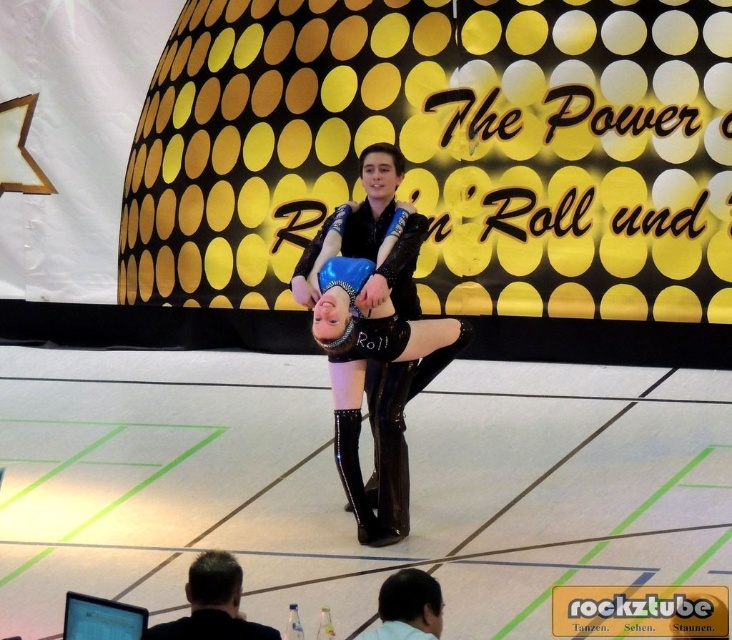
Between point (395, 314) and point (354, 436), which one is positioned in front?

Point (395, 314) is more forward.

Locate an element on the screen. This screenshot has height=640, width=732. glossy blue dress at center is located at coordinates (376, 339).

This screenshot has height=640, width=732. What do you see at coordinates (376, 339) in the screenshot?
I see `glossy blue dress at center` at bounding box center [376, 339].

In order to click on glossy blue dress at center in this screenshot , I will do `click(376, 339)`.